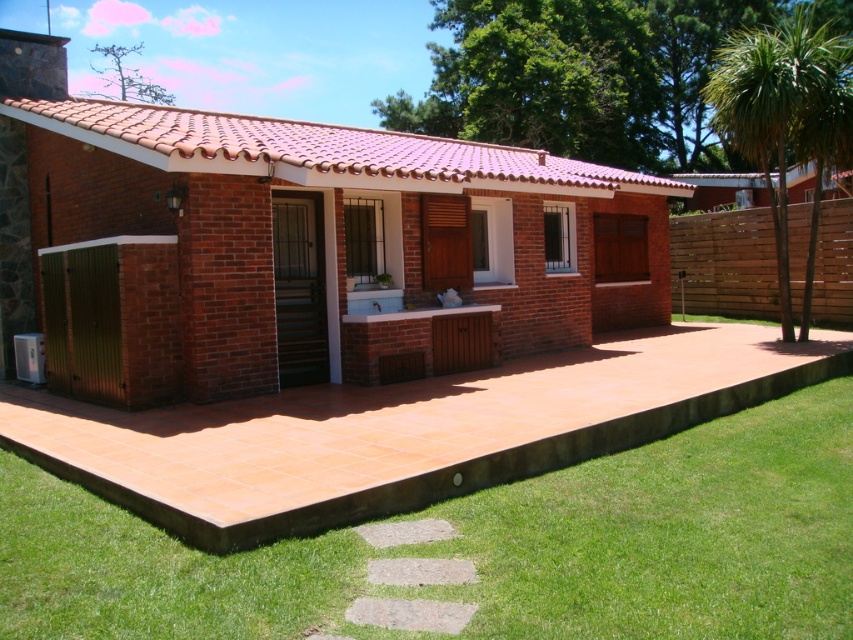
Who is positioned more to the left, terracotta tile terrace at center or green grass at lower left?

Positioned to the left is terracotta tile terrace at center.

Can you confirm if terracotta tile terrace at center is positioned above green grass at lower left?

Yes.

Where is `terracotta tile terrace at center`? The width and height of the screenshot is (853, 640). terracotta tile terrace at center is located at coordinates pyautogui.click(x=316, y=252).

This screenshot has width=853, height=640. Find the location of `terracotta tile terrace at center`. terracotta tile terrace at center is located at coordinates (316, 252).

Consider the image. Can you confirm if terracotta tile terrace at center is positioned below green leafy palm tree at right?

Correct, terracotta tile terrace at center is located below green leafy palm tree at right.

Who is higher up, terracotta tile terrace at center or green leafy palm tree at right?

green leafy palm tree at right

Does point (532, 316) come in front of point (840, 147)?

Yes, it is in front of point (840, 147).

At what (x,y) coordinates should I click in order to perform the action: click on terracotta tile terrace at center. Please return your answer as a coordinate pair (x, y). Image resolution: width=853 pixels, height=640 pixels. Looking at the image, I should click on (316, 252).

The width and height of the screenshot is (853, 640). Describe the element at coordinates (490, 547) in the screenshot. I see `green grass at lower left` at that location.

This screenshot has height=640, width=853. In order to click on green grass at lower left in this screenshot , I will do `click(490, 547)`.

The image size is (853, 640). I want to click on green grass at lower left, so click(490, 547).